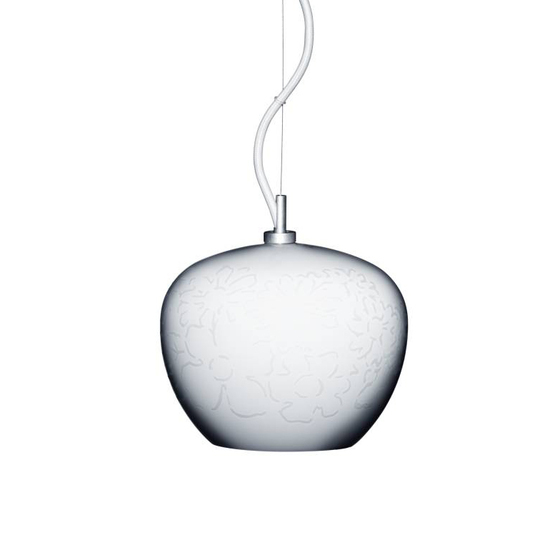
At what (x,y) coordinates should I click in order to perform the action: click on space below lamp. Please return your answer as a coordinate pair (x, y). This screenshot has width=560, height=560. Looking at the image, I should click on (288, 488).